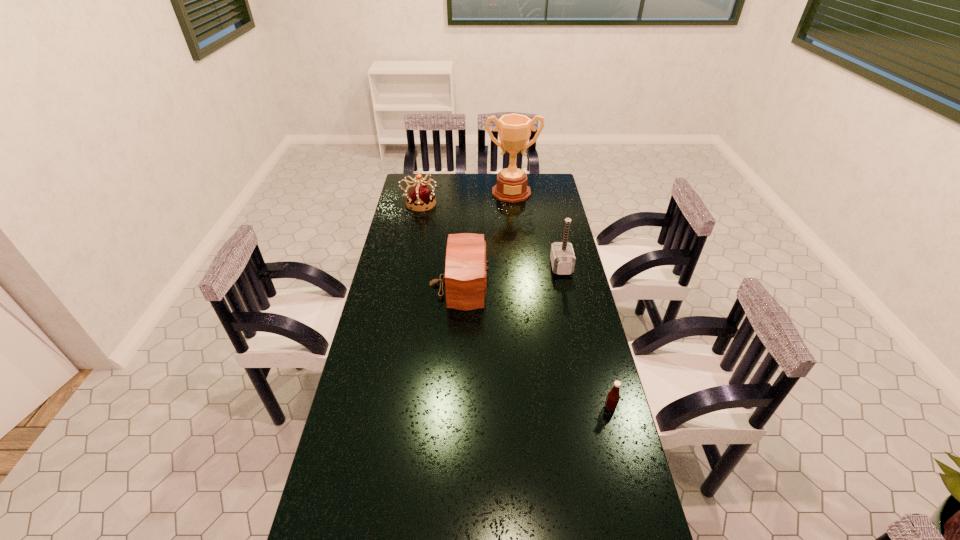
The image size is (960, 540). I want to click on free space that is in between the shortest object and the hammer, so click(586, 337).

The image size is (960, 540). Find the location of `vacant region between the tallest object and the radio receiver`. vacant region between the tallest object and the radio receiver is located at coordinates (486, 238).

The image size is (960, 540). I want to click on the closest object to the tallest object, so click(x=420, y=197).

I want to click on object that is the closest to the tallest object, so click(420, 197).

Locate an element on the screen. vacant region that satisfies the following two spatial constraints: 1. on the front-facing side of the award; 2. on the front-facing side of the leftmost object is located at coordinates (513, 204).

Locate an element on the screen. The width and height of the screenshot is (960, 540). free space that satisfies the following two spatial constraints: 1. for striking with the head of the nearest object; 2. on the left side of the second tallest object is located at coordinates (591, 408).

Find the location of `free point that satisfies the following two spatial constraints: 1. on the front-facing side of the award; 2. on the front-facing side of the leftmost object`. free point that satisfies the following two spatial constraints: 1. on the front-facing side of the award; 2. on the front-facing side of the leftmost object is located at coordinates (513, 204).

The width and height of the screenshot is (960, 540). Identify the location of free space that satisfies the following two spatial constraints: 1. for striking with the head of the fourth shortest object; 2. on the right side of the nearest object. (591, 408).

Identify the location of vacant point that satisfies the following two spatial constraints: 1. on the front-facing side of the award; 2. on the right side of the Tabasco sauce. This screenshot has width=960, height=540. (534, 408).